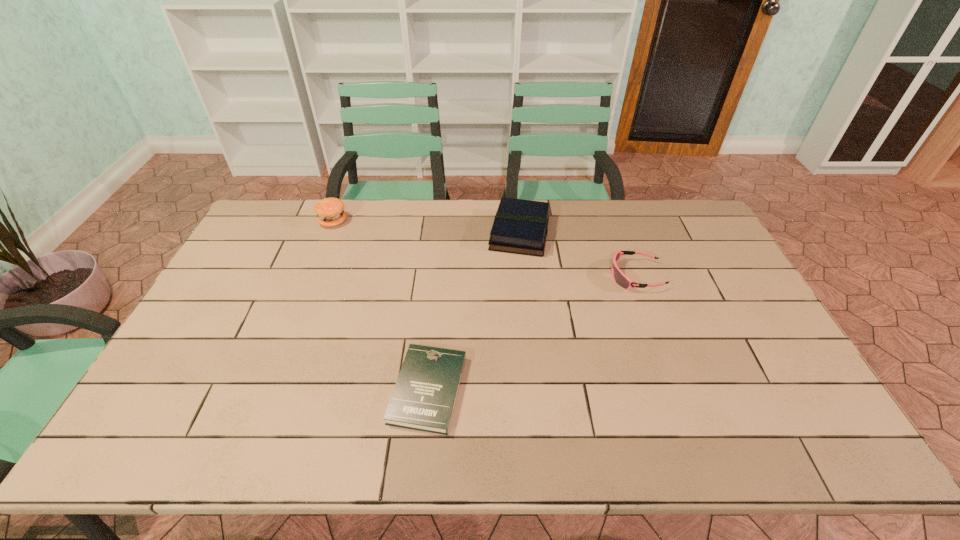
Locate an element on the screen. The width and height of the screenshot is (960, 540). the tallest object is located at coordinates (330, 212).

I want to click on the leftmost object, so click(x=330, y=212).

This screenshot has height=540, width=960. Identify the location of the second object from right to left. (520, 226).

This screenshot has height=540, width=960. What are the coordinates of `the right book` in the screenshot? It's located at (520, 226).

You are a GUI agent. You are given a task and a screenshot of the screen. Output one action in this format:
    pyautogui.click(x=<x>, y=<y>)
    Task: Click on the second nearest object
    
    Given the screenshot: What is the action you would take?
    pyautogui.click(x=620, y=278)

You are a GUI agent. You are given a task and a screenshot of the screen. Output one action in this format:
    pyautogui.click(x=<x>, y=<y>)
    Task: Click on the goggles
    This screenshot has height=540, width=960.
    Given the screenshot: What is the action you would take?
    pyautogui.click(x=620, y=278)

I want to click on the nearer book, so click(424, 396).

The width and height of the screenshot is (960, 540). I want to click on the second object from left to right, so click(x=424, y=396).

Image resolution: width=960 pixels, height=540 pixels. I want to click on vacant space located on the right of the patty, so click(391, 221).

This screenshot has width=960, height=540. In order to click on vacant point located on the right of the taller book in this screenshot , I will do pos(581,233).